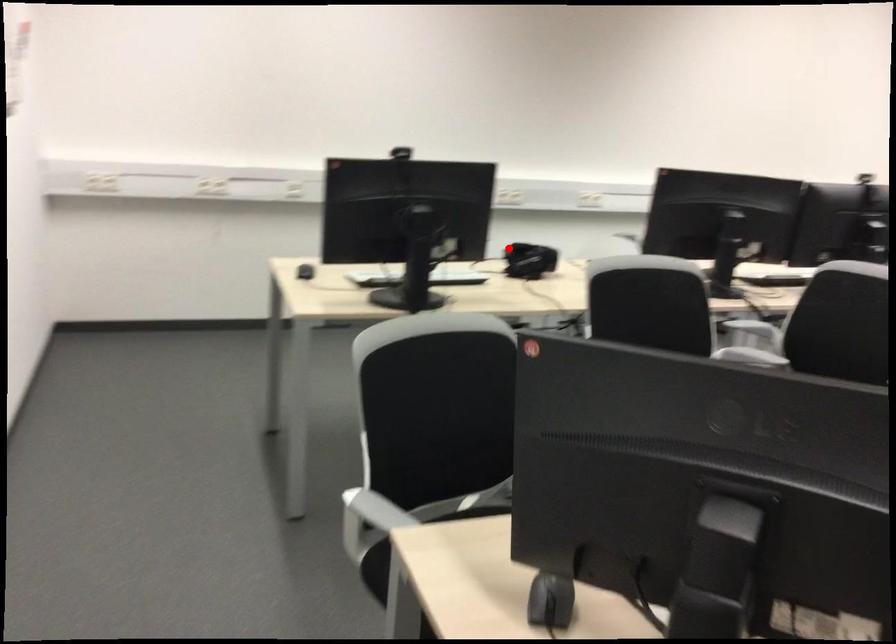
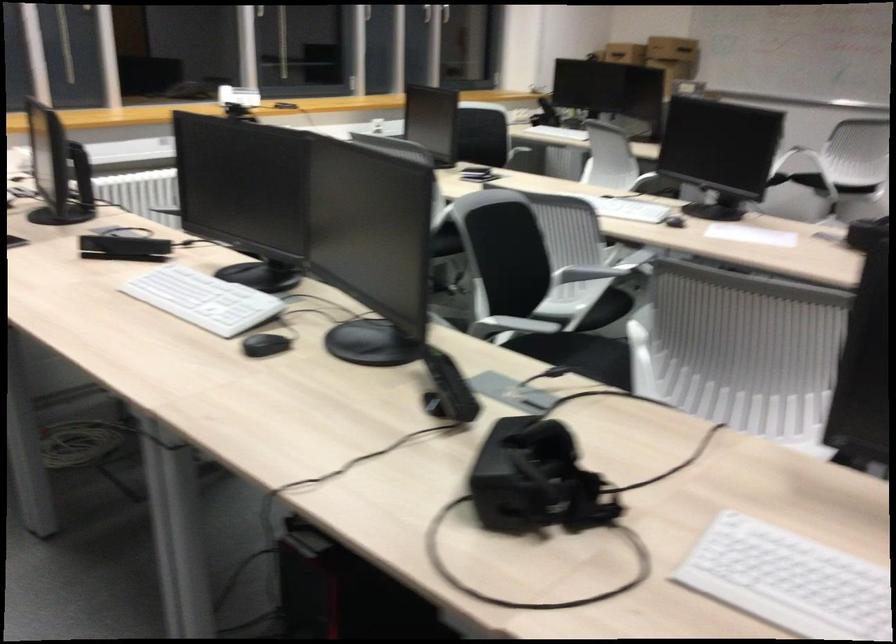
Question: A red point is marked in image1. In image2, is the corresponding 3D point closer to the camera or farther? Reply with the corresponding letter.

Choices:
 (A) The corresponding 3D point is closer.
 (B) The corresponding 3D point is farther.

Answer: (A)